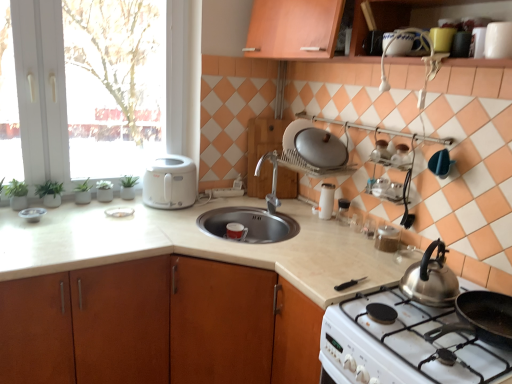
You are a GUI agent. You are given a task and a screenshot of the screen. Output one action in this format:
    pyautogui.click(x=<x>, y=<y>)
    Task: Click on the vacant region to the left of clear glass jar at upper right, the 2th appliance in the front-to-back sequence
    Image resolution: width=512 pixels, height=384 pixels.
    Given the screenshot: What is the action you would take?
    pyautogui.click(x=342, y=241)